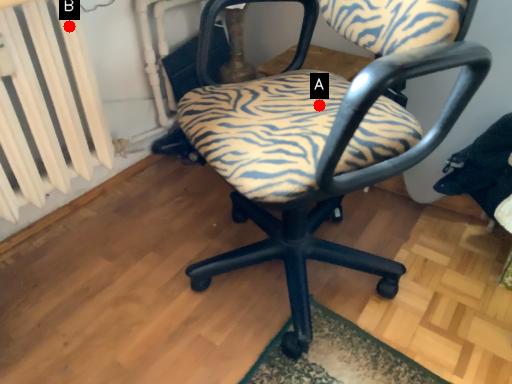
Question: Two points are circled on the image, labeled by A and B beside each circle. Which point is farther to the camera?

Choices:
 (A) A is further
 (B) B is further

Answer: (B)